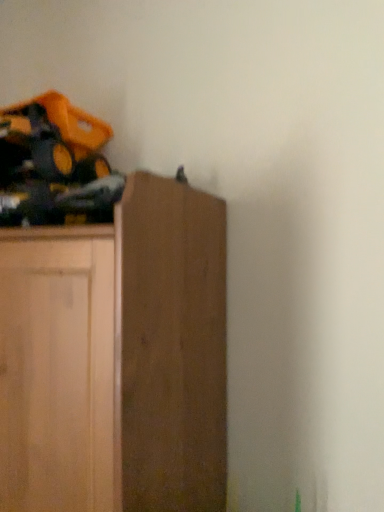
Measure the distance between yellow plastic toy at upper left and camera.

The depth of yellow plastic toy at upper left is 30.24 inches.

Identify the location of yellow plastic toy at upper left. The width and height of the screenshot is (384, 512). (55, 165).

Image resolution: width=384 pixels, height=512 pixels. Describe the element at coordinates (55, 165) in the screenshot. I see `yellow plastic toy at upper left` at that location.

The image size is (384, 512). Find the location of `yellow plastic toy at upper left`. yellow plastic toy at upper left is located at coordinates [55, 165].